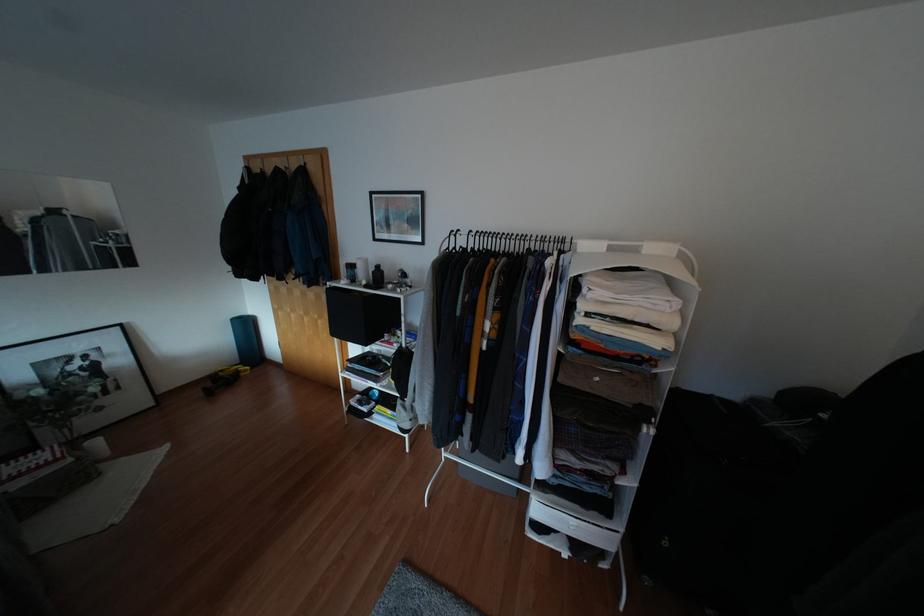
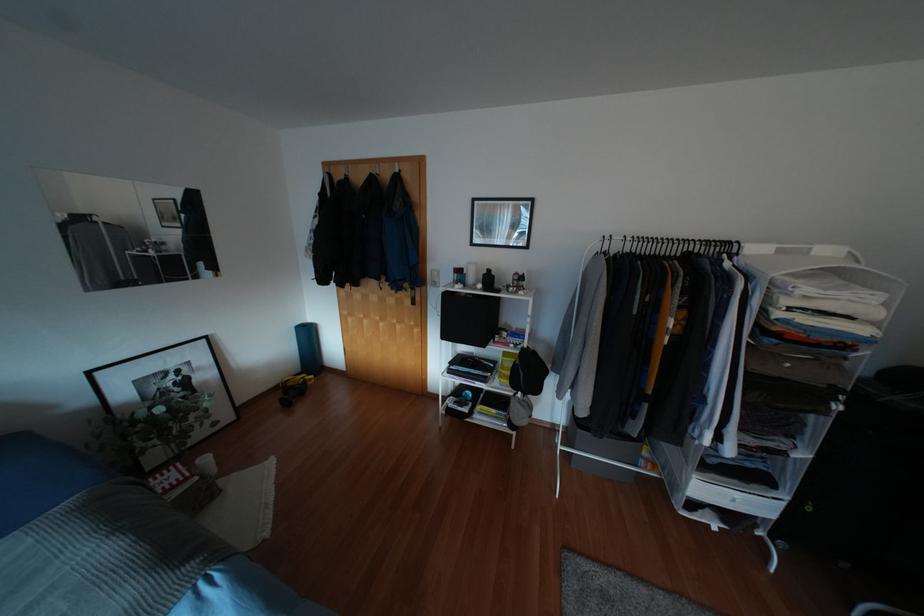
In the second image, find the point that corresponds to (x=94, y=442) in the first image.

(205, 459)